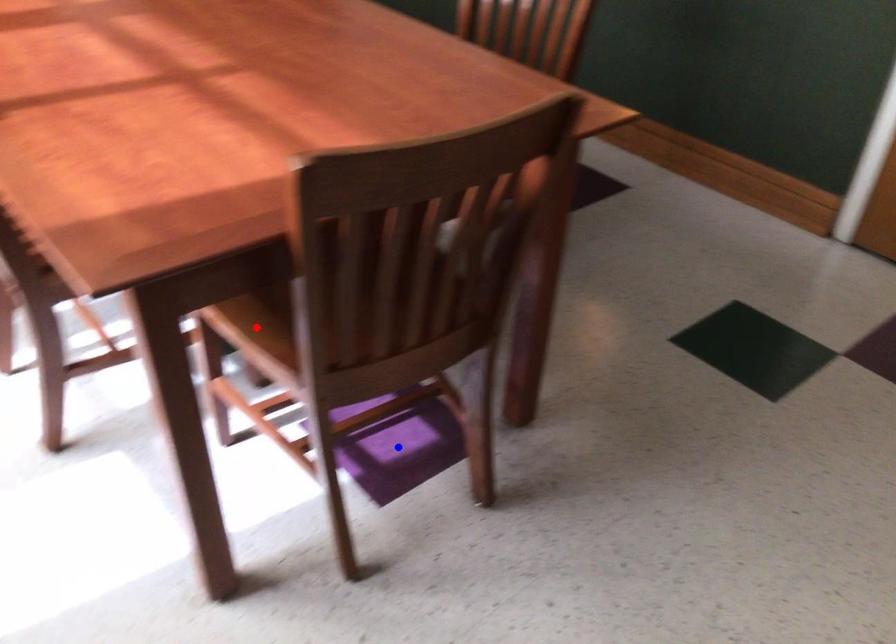
Question: Which of the two points in the image is closer to the camera?

Choices:
 (A) Blue point is closer.
 (B) Red point is closer.

Answer: (B)